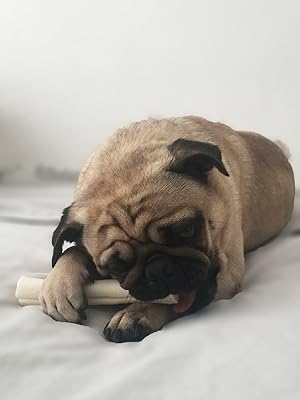
The image size is (300, 400). I want to click on bedcover, white, so click(x=31, y=351).